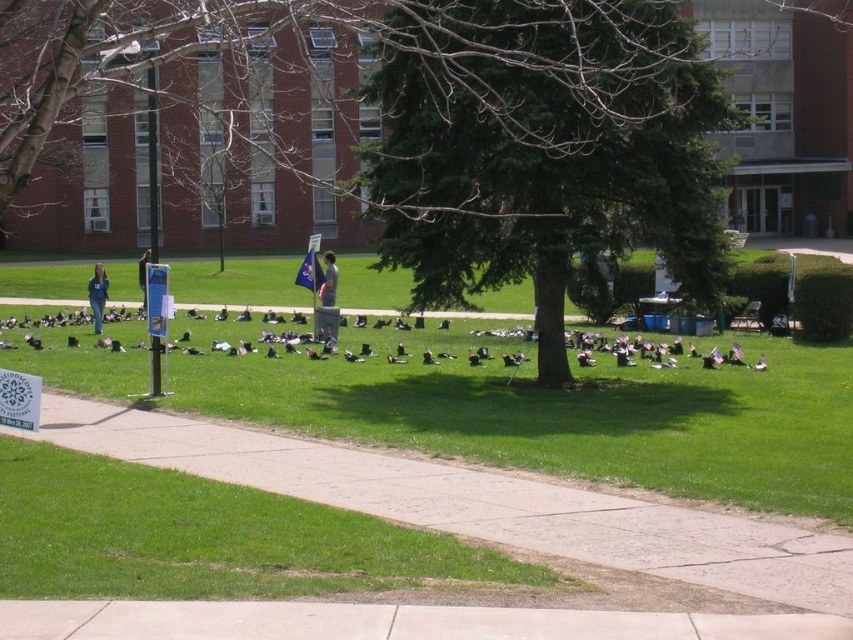
Does concrete sidewalk at center have a greater width compared to concrete at center?

Yes.

Can you confirm if concrete sidewalk at center is smaller than concrete at center?

No.

I want to click on concrete sidewalk at center, so click(x=480, y=502).

Can you confirm if green grass at center is bigger than green textured tree at center?

Yes, green grass at center is bigger than green textured tree at center.

Looking at this image, which is above, green grass at center or green textured tree at center?

green textured tree at center is higher up.

Does point (548, 410) come closer to viewer compared to point (602, 24)?

Yes, point (548, 410) is in front of point (602, 24).

The width and height of the screenshot is (853, 640). In order to click on green grass at center in this screenshot , I will do `click(560, 410)`.

Locate an element on the screen. green textured tree at center is located at coordinates (543, 148).

Is point (399, 72) closer to camera compared to point (410, 352)?

Yes, it is.

Which is in front, point (563, 368) or point (18, 358)?

Point (563, 368)

Locate an element on the screen. This screenshot has width=853, height=640. green textured tree at center is located at coordinates (543, 148).